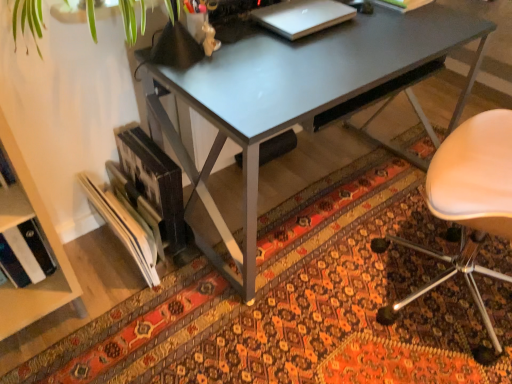
Question: Is the position of patterned carpet at lower center less distant than that of metallic gray desk at center?

Choices:
 (A) yes
 (B) no

Answer: (A)

Question: Is patterned carpet at lower center positioned with its back to metallic gray desk at center?

Choices:
 (A) no
 (B) yes

Answer: (B)

Question: Would you say patterned carpet at lower center is outside metallic gray desk at center?

Choices:
 (A) no
 (B) yes

Answer: (B)

Question: From a real-world perspective, is patterned carpet at lower center over metallic gray desk at center?

Choices:
 (A) yes
 (B) no

Answer: (B)

Question: Are patterned carpet at lower center and metallic gray desk at center located far from each other?

Choices:
 (A) no
 (B) yes

Answer: (A)

Question: Considering the relative sizes of patterned carpet at lower center and metallic gray desk at center in the image provided, is patterned carpet at lower center smaller than metallic gray desk at center?

Choices:
 (A) no
 (B) yes

Answer: (B)

Question: From a real-world perspective, is hardcover book at upper center located beneath sleek silver laptop at upper center?

Choices:
 (A) no
 (B) yes

Answer: (A)

Question: Considering the relative sizes of hardcover book at upper center and sleek silver laptop at upper center in the image provided, is hardcover book at upper center smaller than sleek silver laptop at upper center?

Choices:
 (A) yes
 (B) no

Answer: (B)

Question: Is the position of hardcover book at upper center more distant than that of sleek silver laptop at upper center?

Choices:
 (A) yes
 (B) no

Answer: (A)

Question: Can you confirm if hardcover book at upper center is positioned to the right of sleek silver laptop at upper center?

Choices:
 (A) yes
 (B) no

Answer: (A)

Question: Is hardcover book at upper center to the left of sleek silver laptop at upper center from the viewer's perspective?

Choices:
 (A) no
 (B) yes

Answer: (A)

Question: Can you confirm if hardcover book at upper center is wider than sleek silver laptop at upper center?

Choices:
 (A) yes
 (B) no

Answer: (A)

Question: Considering the relative sizes of sleek silver laptop at upper center and beige leather chair at right in the image provided, is sleek silver laptop at upper center shorter than beige leather chair at right?

Choices:
 (A) yes
 (B) no

Answer: (A)